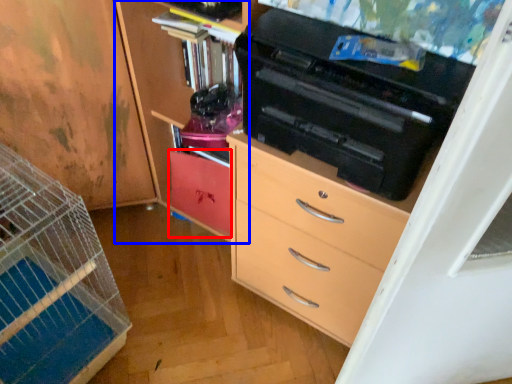
Question: Which object is further to the camera taking this photo, cabinetry (highlighted by a red box) or cabinetry (highlighted by a blue box)?

Choices:
 (A) cabinetry
 (B) cabinetry

Answer: (A)